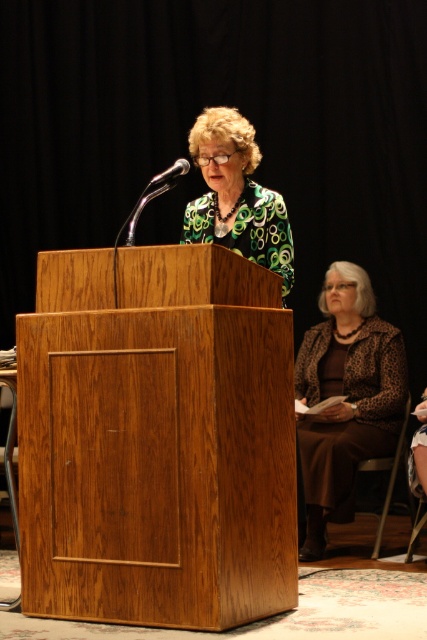
You are organizing a small event and need to place a 1.2 meter wide decorative panel between the leopard print jacket at lower right and the brown fabric chair at lower right. Based on their sizes, will the panel fit between them?

The leopard print jacket at lower right is bigger than the brown fabric chair at lower right. Since the panel is 1.2 meters wide, it might not fit between them if the space between the two objects is smaller than 1.2 meters. However, the exact distance isn

You are standing at the front of the room and want to hand a document to the person wearing the leopard print jacket at lower right. Based on their position, in which direction should you move to reach them?

The leopard print jacket at lower right is located at point 0.622 on the x axis and 0.813 on the y axis, so you should move towards the lower right direction to reach them.

You are organizing an event and need to place a 1.2 meter wide banner between the brown fabric chair at lower right and the metallic silver microphone at upper left. Can the banner fit between them?

The brown fabric chair at lower right is wider than the metallic silver microphone at upper left. However, the exact distance between them isn t specified, so we can t confirm if the 1.2 meter banner will fit. More information about their spacing is needed.